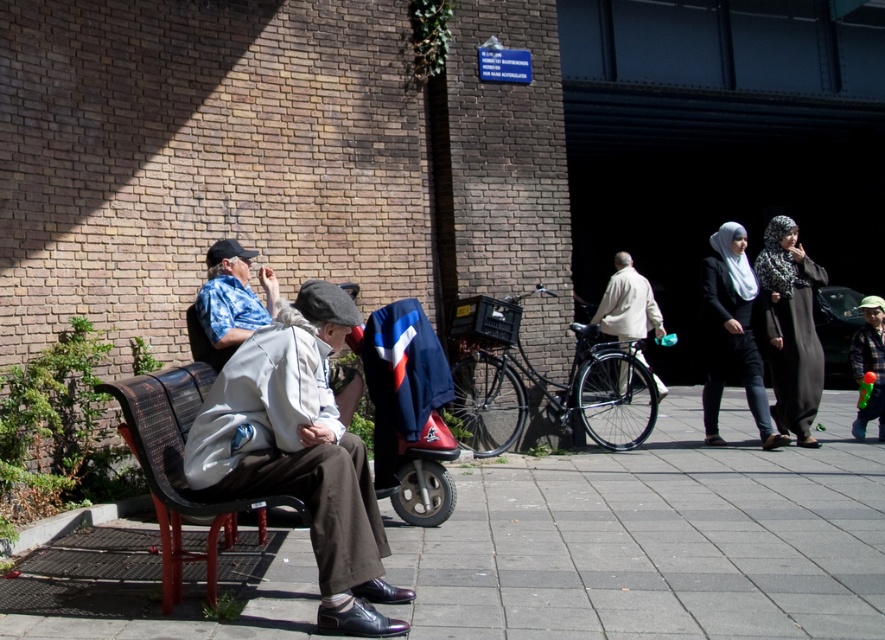
Question: Does white scarf at center appear on the left side of blue patterned shirt at left?

Choices:
 (A) no
 (B) yes

Answer: (A)

Question: Which point appears farthest from the camera in this image?

Choices:
 (A) (601, 307)
 (B) (807, 376)

Answer: (A)

Question: Observing the image, what is the correct spatial positioning of smooth concrete pavement at lower left in reference to light beige jacket at center?

Choices:
 (A) left
 (B) right

Answer: (A)

Question: Among these objects, which one is nearest to the camera?

Choices:
 (A) light beige jacket at center
 (B) white scarf at center
 (C) light gray fabric coat at center
 (D) dark gray textured abaya at right

Answer: (C)

Question: Which point is closer to the camera taking this photo?

Choices:
 (A) (237, 300)
 (B) (310, 445)
 (C) (750, 332)
 (D) (724, 595)

Answer: (B)

Question: Can you confirm if smooth concrete pavement at lower left is positioned below white scarf at center?

Choices:
 (A) yes
 (B) no

Answer: (A)